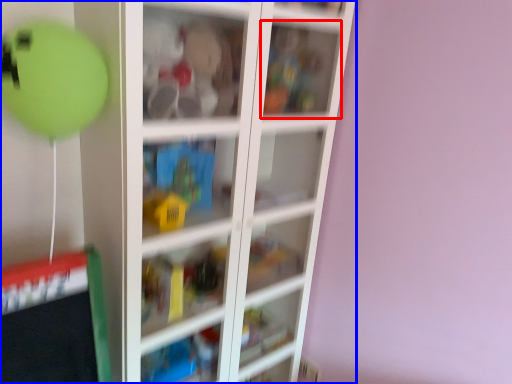
Question: Which object is further to the camera taking this photo, cabinet (highlighted by a red box) or shelf (highlighted by a blue box)?

Choices:
 (A) cabinet
 (B) shelf

Answer: (A)